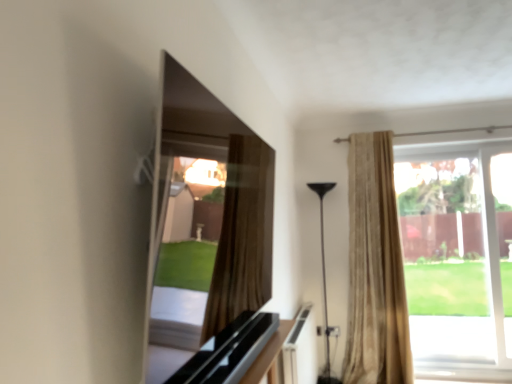
Question: Is clear glass window at right taller than beige textured curtain at right?

Choices:
 (A) no
 (B) yes

Answer: (A)

Question: Is there a large distance between clear glass window at right and beige textured curtain at right?

Choices:
 (A) yes
 (B) no

Answer: (B)

Question: Considering the relative sizes of clear glass window at right and beige textured curtain at right in the image provided, is clear glass window at right shorter than beige textured curtain at right?

Choices:
 (A) yes
 (B) no

Answer: (A)

Question: From the image's perspective, would you say clear glass window at right is shown under beige textured curtain at right?

Choices:
 (A) no
 (B) yes

Answer: (B)

Question: Can you confirm if clear glass window at right is wider than beige textured curtain at right?

Choices:
 (A) no
 (B) yes

Answer: (A)

Question: Is clear glass window at right at the right side of beige textured curtain at right?

Choices:
 (A) no
 (B) yes

Answer: (B)

Question: Does black glossy floor lamp at center come in front of smooth glass tv at upper center?

Choices:
 (A) no
 (B) yes

Answer: (A)

Question: Is smooth glass tv at upper center a part of black glossy floor lamp at center?

Choices:
 (A) yes
 (B) no

Answer: (B)

Question: Considering the relative sizes of black glossy floor lamp at center and smooth glass tv at upper center in the image provided, is black glossy floor lamp at center thinner than smooth glass tv at upper center?

Choices:
 (A) yes
 (B) no

Answer: (B)

Question: Is black glossy floor lamp at center facing towards smooth glass tv at upper center?

Choices:
 (A) yes
 (B) no

Answer: (A)

Question: Is black glossy floor lamp at center behind smooth glass tv at upper center?

Choices:
 (A) no
 (B) yes

Answer: (B)

Question: From a real-world perspective, does black glossy floor lamp at center sit lower than smooth glass tv at upper center?

Choices:
 (A) yes
 (B) no

Answer: (A)

Question: Is smooth glass tv at upper center wider than clear glass window at right?

Choices:
 (A) no
 (B) yes

Answer: (B)